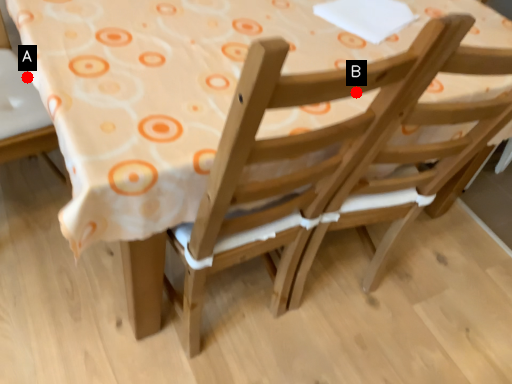
Question: Two points are circled on the image, labeled by A and B beside each circle. Which of the following is the closest to the observer?

Choices:
 (A) A is closer
 (B) B is closer

Answer: (B)